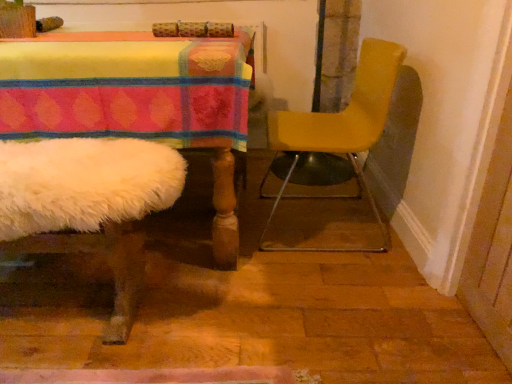
What do you see at coordinates (337, 153) in the screenshot? This screenshot has height=384, width=512. I see `yellow leather chair at right` at bounding box center [337, 153].

Locate an element on the screen. Image resolution: width=512 pixels, height=384 pixels. yellow leather chair at right is located at coordinates (337, 153).

Identify the location of yellow leather chair at right. The height and width of the screenshot is (384, 512). (337, 153).